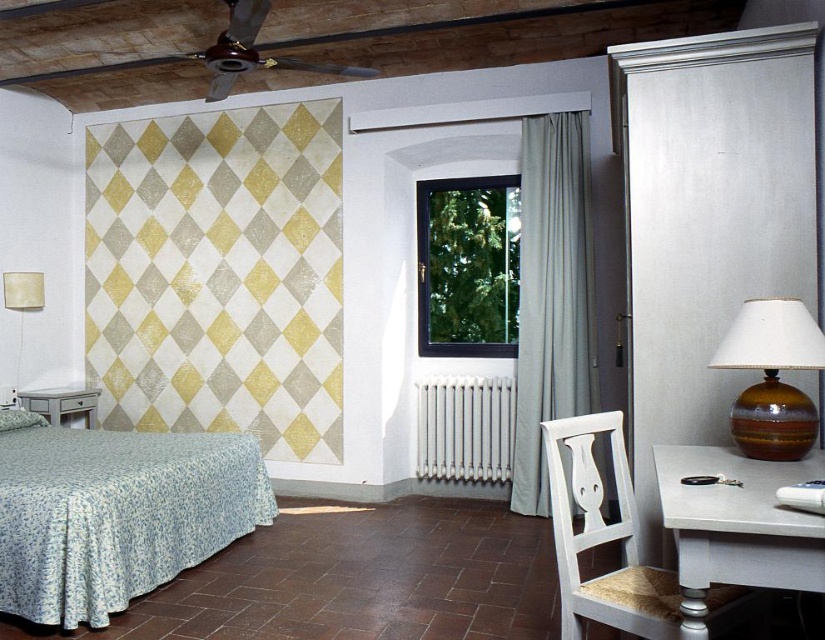
Can you confirm if green fabric curtain at center is positioned above brown glossy lamp at right?

Yes, green fabric curtain at center is above brown glossy lamp at right.

Is point (531, 276) less distant than point (747, 317)?

No, (531, 276) is further to viewer.

You are a GUI agent. You are given a task and a screenshot of the screen. Output one action in this format:
    pyautogui.click(x=<x>, y=<y>)
    Task: Click on the green fabric curtain at center
    This screenshot has width=825, height=640.
    Given the screenshot: What is the action you would take?
    pyautogui.click(x=550, y=296)

In the scene shown: Which of these two, white glossy table at lower right or white wood chair at lower right, stands taller?

white wood chair at lower right is taller.

Who is more forward, (x=694, y=561) or (x=606, y=579)?

Point (x=694, y=561) is in front.

The image size is (825, 640). Find the location of `white glossy table at lower right`. white glossy table at lower right is located at coordinates (736, 525).

Looking at this image, can you confirm if white wood chair at lower right is positioned to the left of brown glossy lamp at right?

Correct, you'll find white wood chair at lower right to the left of brown glossy lamp at right.

The width and height of the screenshot is (825, 640). What do you see at coordinates (611, 540) in the screenshot? I see `white wood chair at lower right` at bounding box center [611, 540].

Find the location of `white wood chair at lower right`. white wood chair at lower right is located at coordinates (611, 540).